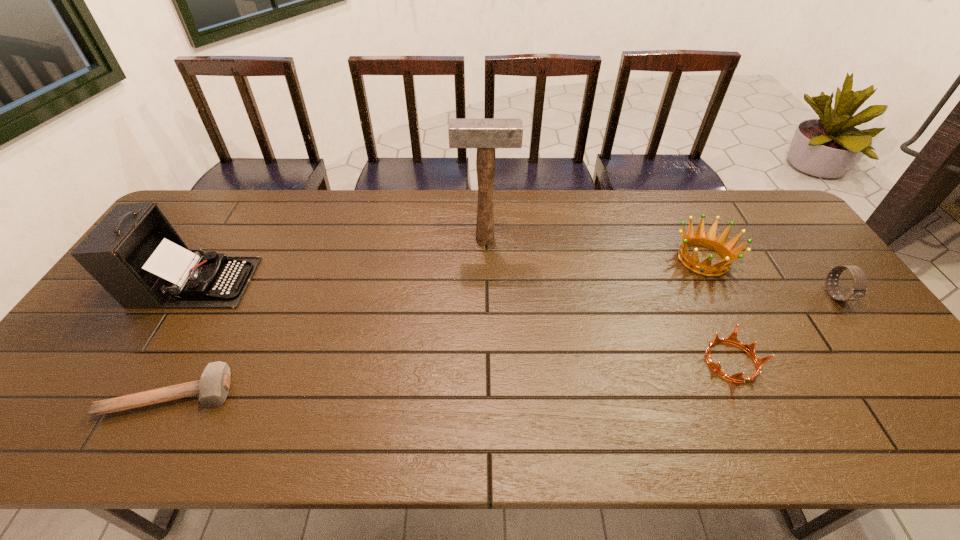
Where is `free space located inside the open case of the typewriter`? free space located inside the open case of the typewriter is located at coordinates (314, 282).

Identify the location of free space located on the left of the farther crown. (655, 259).

This screenshot has height=540, width=960. What are the coordinates of `vacant space situated on the face of the watch` in the screenshot? It's located at (894, 373).

Image resolution: width=960 pixels, height=540 pixels. In order to click on vacant space situated 0.150m on the left of the shorter crown in this screenshot , I will do `click(641, 362)`.

Where is `vacant space situated on the left of the nearer mallet`? vacant space situated on the left of the nearer mallet is located at coordinates (62, 395).

Where is `object that is at the far edge`? Image resolution: width=960 pixels, height=540 pixels. object that is at the far edge is located at coordinates (484, 134).

Image resolution: width=960 pixels, height=540 pixels. I want to click on object that is at the near edge, so click(213, 387).

Locate an element on the screen. typewriter located in the left edge section of the desktop is located at coordinates click(134, 253).

This screenshot has height=540, width=960. I want to click on mallet located in the left edge section of the desktop, so click(x=213, y=387).

Find the location of `object that is at the right edge`. object that is at the right edge is located at coordinates (859, 289).